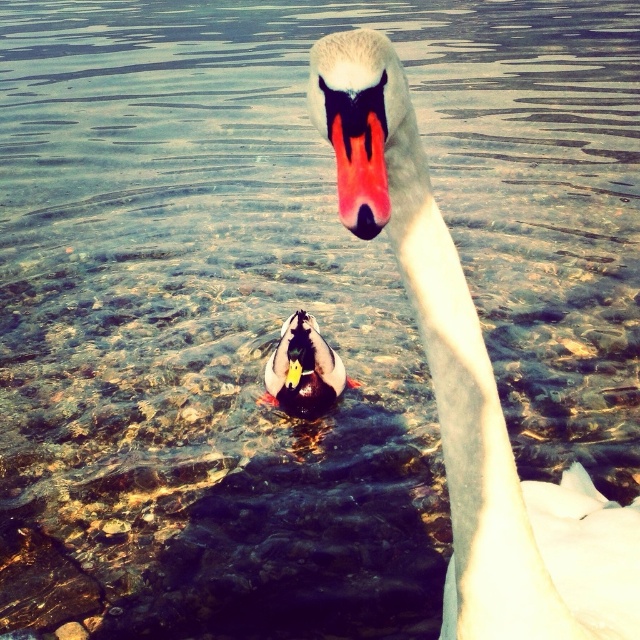
You are standing at the edge of the water and want to take a photo of the shiny multicolored duck at center. Where should you aim your camera to capture it?

You should aim your camera at point (304, 369) to capture the shiny multicolored duck at center.

You are a photographer trying to capture the shiny multicolored duck at center and the matte black beak at center in a single shot. Which object should you focus on first to ensure both are in focus?

You should focus on the shiny multicolored duck at center first because it is positioned under the matte black beak at center, so focusing on the closer object will help both be in focus.

You are a photographer trying to capture both the white glossy swan at upper center and the shiny multicolored duck at center in a single frame. Based on their heights, which bird should you focus on first to ensure both are in the shot?

The white glossy swan at upper center has a greater height compared to the shiny multicolored duck at center. To ensure both are in the shot, focus on the white glossy swan at upper center first as it is taller and will require more vertical space in the frame.